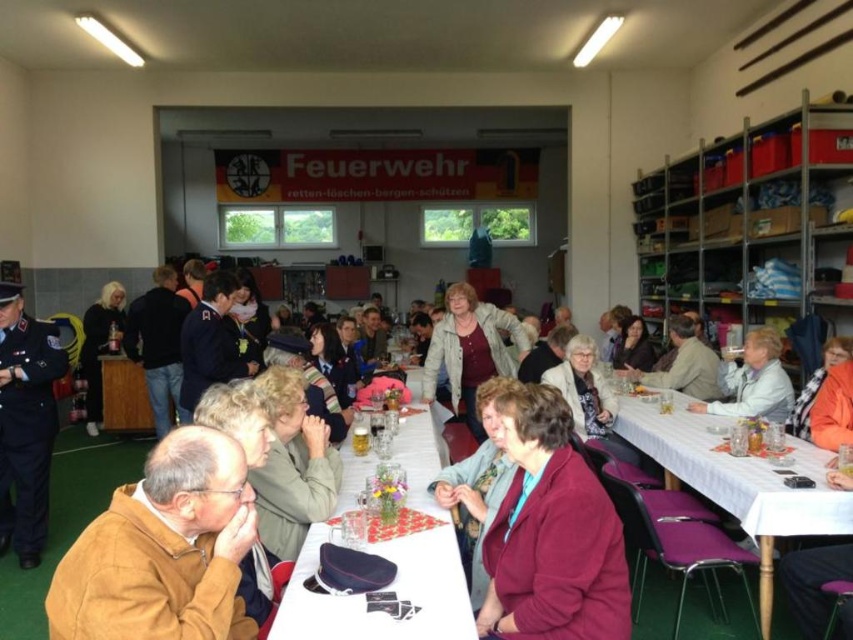
Does dark blue uniform at center appear over orange fabric jacket at lower right?

Yes.

Does dark blue uniform at center have a lesser width compared to orange fabric jacket at lower right?

No.

Between point (222, 364) and point (801, 432), which one is positioned in front?

Positioned in front is point (801, 432).

Where is `dark blue uniform at center`? The width and height of the screenshot is (853, 640). dark blue uniform at center is located at coordinates (212, 340).

Can you confirm if maroon fabric coat at lower center is positioned below dark blue uniform at center?

Yes, maroon fabric coat at lower center is below dark blue uniform at center.

Which is behind, point (601, 554) or point (206, 280)?

Positioned behind is point (206, 280).

Which is behind, point (543, 632) or point (193, 378)?

Point (193, 378)

I want to click on maroon fabric coat at lower center, so click(x=550, y=532).

Is point (432, 582) positioned after point (786, 440)?

No.

Based on the photo, can you confirm if white plastic table at center is taller than white plastic table at lower right?

In fact, white plastic table at center may be shorter than white plastic table at lower right.

Locate an element on the screen. The width and height of the screenshot is (853, 640). white plastic table at center is located at coordinates (393, 561).

What are the coordinates of `white plastic table at center` in the screenshot? It's located at (393, 561).